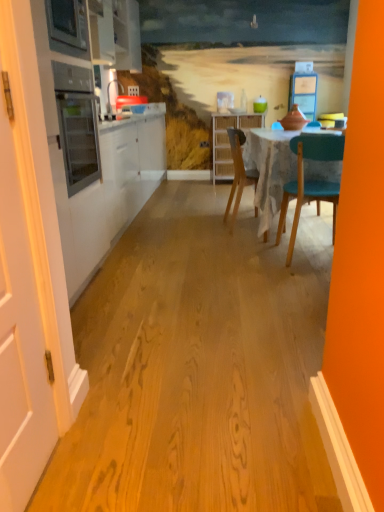
Question: Can you confirm if woven wood cabinet at center, the first cabinetry positioned from the back, is taller than wooden chair at center?

Choices:
 (A) yes
 (B) no

Answer: (A)

Question: Is woven wood cabinet at center, the 2th cabinetry viewed from the left, oriented away from wooden chair at center?

Choices:
 (A) yes
 (B) no

Answer: (B)

Question: Considering the relative positions of woven wood cabinet at center, the 2th cabinetry viewed from the left, and wooden chair at center in the image provided, is woven wood cabinet at center, the 2th cabinetry viewed from the left, in front of wooden chair at center?

Choices:
 (A) yes
 (B) no

Answer: (B)

Question: From the image's perspective, is woven wood cabinet at center, the 2th cabinetry viewed from the left, under wooden chair at center?

Choices:
 (A) yes
 (B) no

Answer: (B)

Question: Is wooden chair at center inside woven wood cabinet at center, marked as the second cabinetry in a top-to-bottom arrangement?

Choices:
 (A) no
 (B) yes

Answer: (A)

Question: Is white matte door at left in front of or behind wooden chair at center in the image?

Choices:
 (A) behind
 (B) front

Answer: (B)

Question: Considering the positions of point (16, 96) and point (238, 192), is point (16, 96) closer or farther from the camera than point (238, 192)?

Choices:
 (A) farther
 (B) closer

Answer: (B)

Question: From a real-world perspective, relative to wooden chair at center, is white matte door at left vertically above or below?

Choices:
 (A) below
 (B) above

Answer: (B)

Question: Is white matte door at left bigger or smaller than wooden chair at center?

Choices:
 (A) small
 (B) big

Answer: (A)

Question: Considering the positions of wooden chair at center and white glossy cabinet at upper left, which is the second cabinetry from back to front, in the image, is wooden chair at center bigger or smaller than white glossy cabinet at upper left, which is the second cabinetry from back to front,?

Choices:
 (A) small
 (B) big

Answer: (A)

Question: In terms of height, does wooden chair at center look taller or shorter compared to white glossy cabinet at upper left, marked as the 2th cabinetry in a bottom-to-top arrangement?

Choices:
 (A) tall
 (B) short

Answer: (A)

Question: Is wooden chair at center to the left or to the right of white glossy cabinet at upper left, which is counted as the 1th cabinetry, starting from the top, in the image?

Choices:
 (A) right
 (B) left

Answer: (A)

Question: In terms of width, does wooden chair at center look wider or thinner when compared to white glossy cabinet at upper left, which is the second cabinetry from back to front?

Choices:
 (A) wide
 (B) thin

Answer: (A)

Question: Based on their sizes in the image, would you say wooden chair at center is bigger or smaller than woven wood cabinet at center, marked as the second cabinetry in a top-to-bottom arrangement?

Choices:
 (A) big
 (B) small

Answer: (B)

Question: Is wooden chair at center taller or shorter than woven wood cabinet at center, the first cabinetry positioned from the back?

Choices:
 (A) tall
 (B) short

Answer: (B)